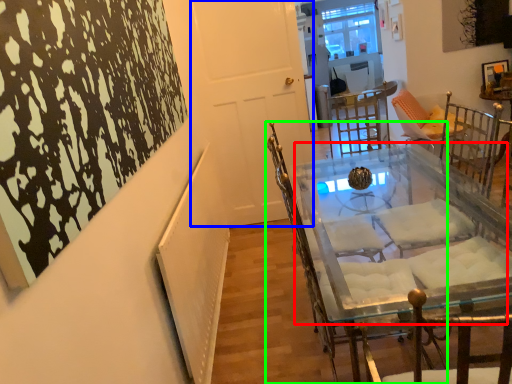
Question: Considering the real-world distances, which object is closest to round table (highlighted by a red box)? door (highlighted by a blue box) or chair (highlighted by a green box).

Choices:
 (A) door
 (B) chair

Answer: (B)